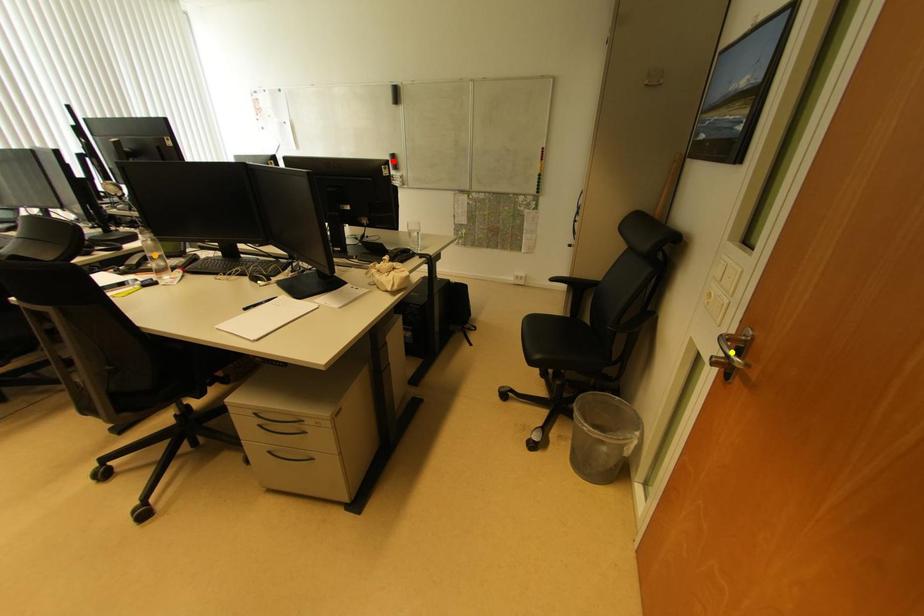
Order these from farthest to nearest:
orange point
yellow point
red point

red point < orange point < yellow point